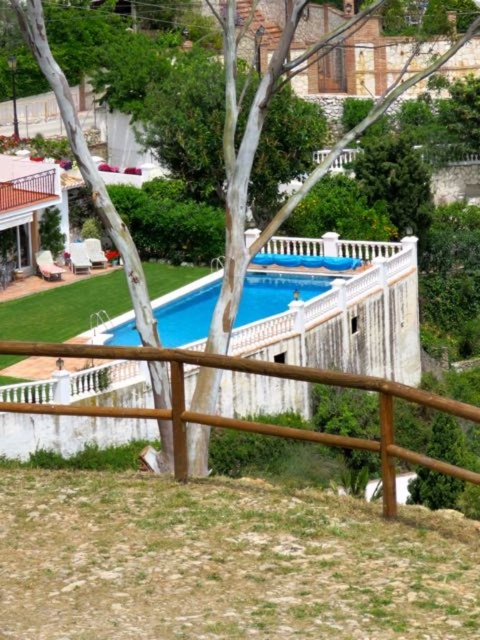
You are a maintenance worker who needs to assess the space between the brown wooden fence at center and the blue smooth pool at center. Based on their sizes, which object would require more materials to cover its entire surface?

The brown wooden fence at center has a larger size compared to the blue smooth pool at center, so it would require more materials to cover its entire surface.

Based on the photo, you are standing at the center of the image and want to walk towards the brown wooden fence at center. Which direction should you move in?

Since the brown wooden fence at center is located at point 0.658 on the x axis and 0.521 on the y axis, you should move towards the center of the image to reach it.